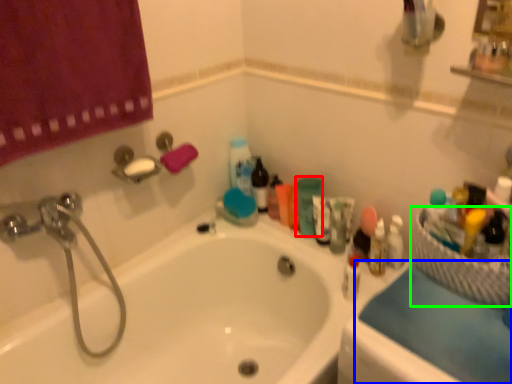
Question: Based on their relative distances, which object is nearer to toiletry (highlighted by a red box)? Choose from counter top (highlighted by a blue box) and basket (highlighted by a green box).

Choices:
 (A) counter top
 (B) basket

Answer: (B)